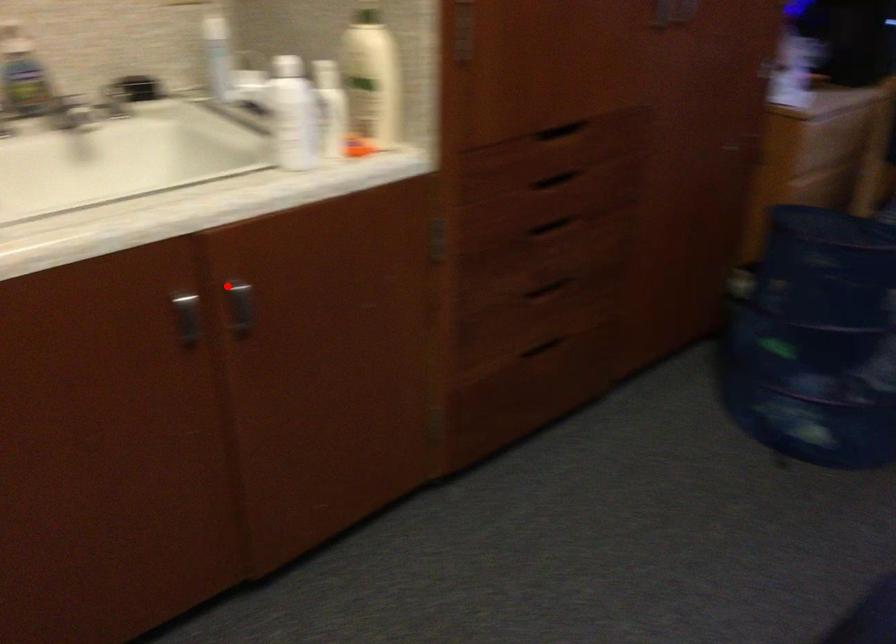
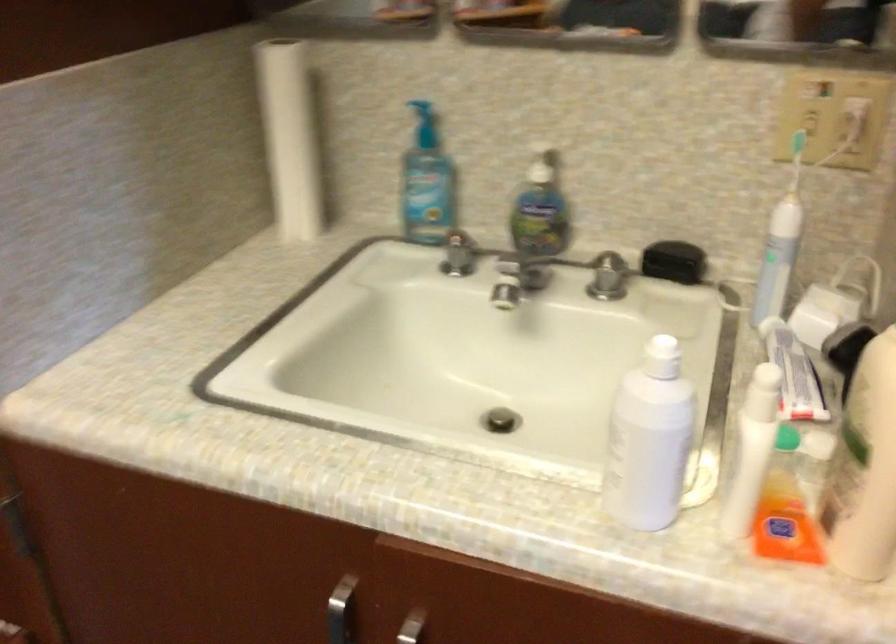
The point at the highlighted location is marked in the first image. Where is the corresponding point in the second image?

(411, 627)